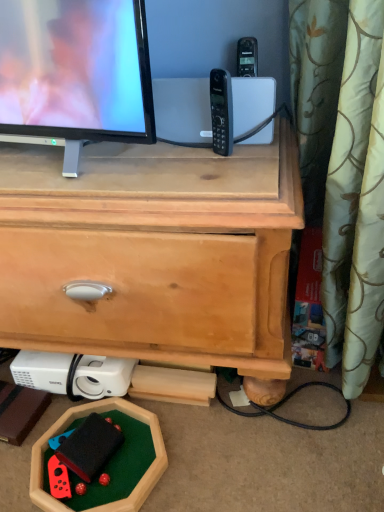
In order to click on empty space that is to the right of rubberized red game controller at lower left in this screenshot , I will do `click(136, 453)`.